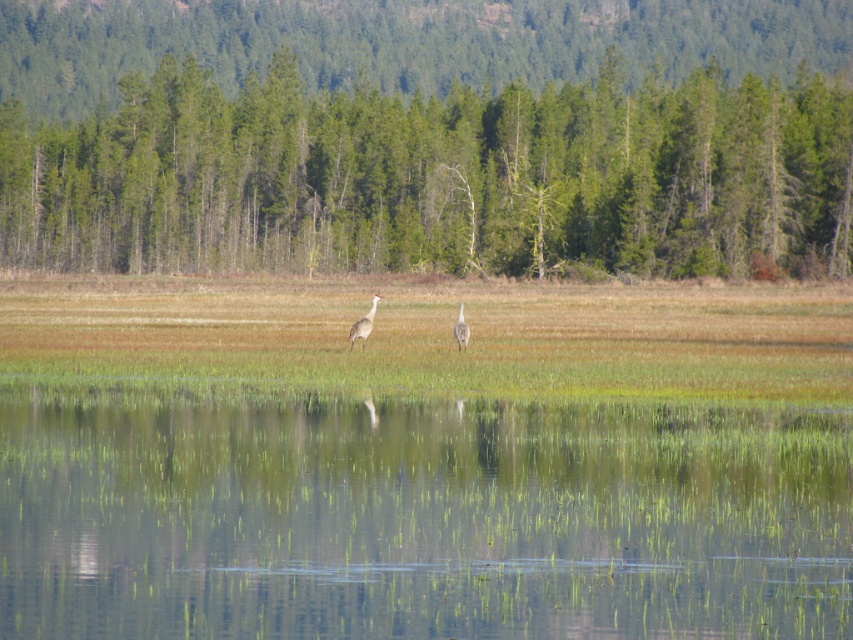
Does green matte trees at center have a larger size compared to gray feathered bird at center?

Yes, green matte trees at center is bigger than gray feathered bird at center.

Does green matte trees at center have a greater width compared to gray feathered bird at center?

Correct, the width of green matte trees at center exceeds that of gray feathered bird at center.

Who is more distant from viewer, (x=26, y=22) or (x=352, y=339)?

The point (x=26, y=22) is behind.

Find the location of `green matte trees at center`. green matte trees at center is located at coordinates (428, 138).

Can you confirm if green matte trees at center is wider than white feathered bird at center?

Indeed, green matte trees at center has a greater width compared to white feathered bird at center.

Can you confirm if green matte trees at center is positioned to the left of white feathered bird at center?

No, green matte trees at center is not to the left of white feathered bird at center.

Who is more forward, (628, 83) or (456, 328)?

Positioned in front is point (456, 328).

This screenshot has width=853, height=640. Identify the location of green matte trees at center. [x=428, y=138].

Between gray feathered bird at center and white feathered bird at center, which one has more height?

Standing taller between the two is gray feathered bird at center.

Is gray feathered bird at center closer to camera compared to white feathered bird at center?

Yes, gray feathered bird at center is closer to the viewer.

In the scene shown: Who is more forward, (367, 328) or (466, 333)?

→ Point (367, 328)

I want to click on gray feathered bird at center, so click(363, 324).